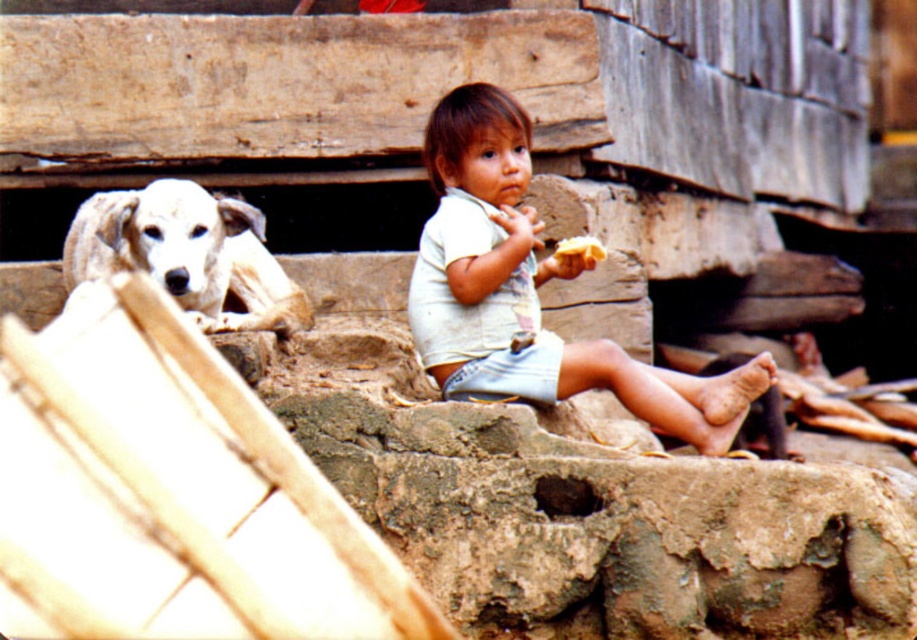
You are a photographer trying to capture a closeup of the light beige cotton shirt at center and the white fur dog at left. Your camera has a maximum focus range of 1 meter. Can you take a photo of both subjects without moving either the camera or the subjects?

The distance between the light beige cotton shirt at center and the white fur dog at left is 1.25 meters, which exceeds the camera maximum focus range of 1 meter. Therefore, you cannot take a photo of both subjects without moving the camera or the subjects.

You are a photographer standing at the center of the scene. You want to take a photo of the white fur dog at left. According to the coordinates given, where should you aim your camera?

The white fur dog at left is located at coordinates point (186, 253), so you should aim your camera towards that point to capture the dog in the frame.

You are standing in the rustic outdoor scene and want to reach the point marked as point (149, 241). If you take a step forward, will you get closer to or farther from this point?

The point (149, 241) is 8.48 meters away from viewer. Taking a step forward would decrease the distance, so you would get closer to the point (149, 241).